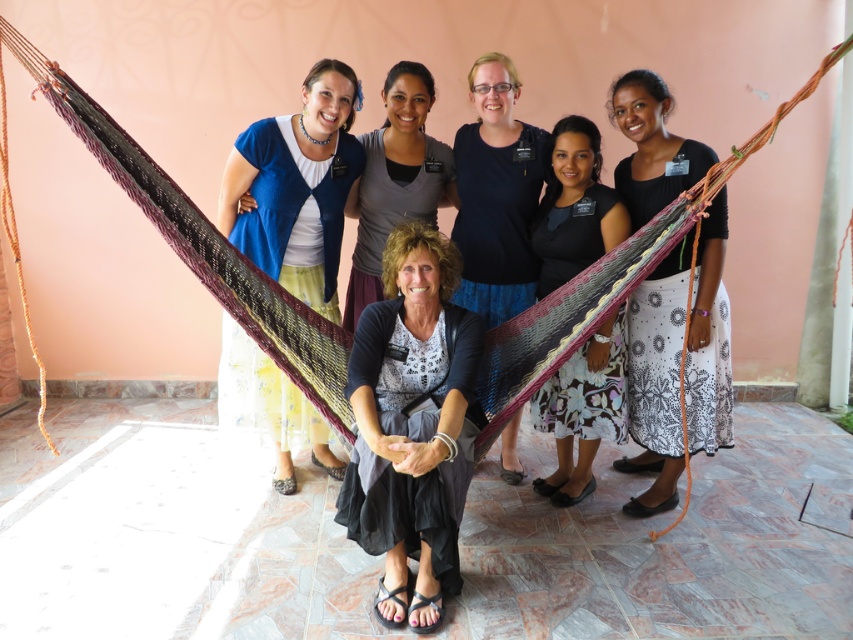
You are standing in the room where the group of women is posing. You want to hand a gift to the woman wearing the dark gray linen skirt at center without moving closer than 2 meters. Is this possible?

The dark gray linen skirt at center and the viewer are 2.03 meters apart from each other. Since 2.03 meters is slightly more than 2 meters, you can hand the gift without moving closer than 2 meters.